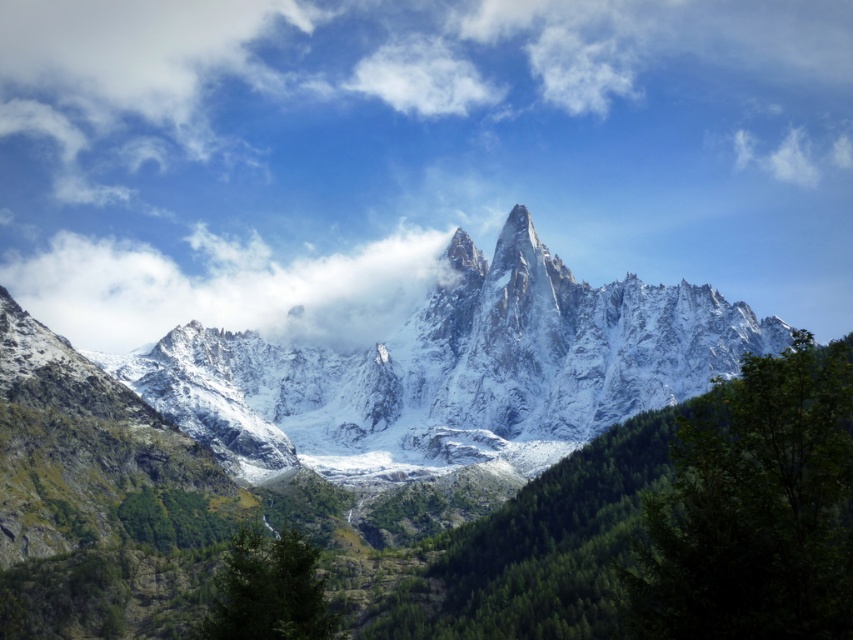
You are planning to take a photo of the snowy granite mountain range at center and the green matte tree at lower center. Which object should you focus on first if you want to capture both in a single frame without moving the camera?

You should focus on the snowy granite mountain range at center first because it is larger in size than the green matte tree at lower center, so it will occupy more of the frame and ensure it is properly centered in the composition.

You are a hiker planning to take a photo of the snowy granite mountain range at center and the green leafy tree at lower right. Which object should you focus on first if you want both to be in sharp focus?

You should focus on the snowy granite mountain range at center first because it is closer to you than the green leafy tree at lower right, ensuring both will be in focus when using depth of field properly.

You are a hiker planning to traverse between the two points marked as point [265,467]. Given that the average walking speed is 3 km per hour, how long would it take to walk between them?

The two points marked as point [265,467] are 175.57 meters apart. At an average walking speed of 3 km per hour, it would take approximately 3.5 minutes to walk between them.